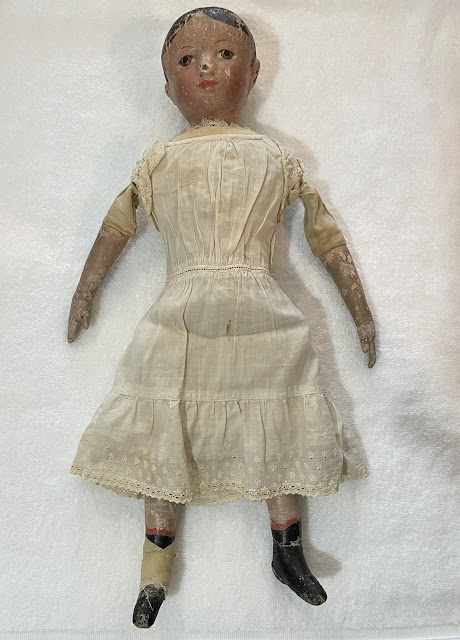
Locate an element on the screen. This screenshot has height=640, width=460. cloth background is located at coordinates (379, 192).